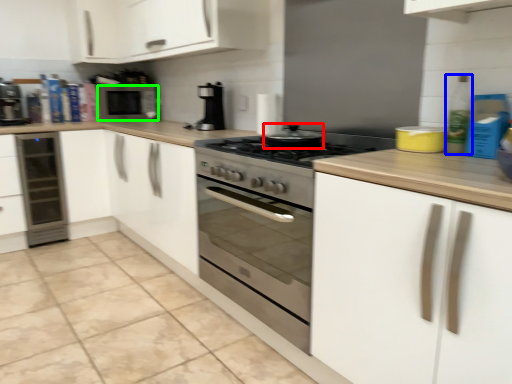
Question: Based on their relative distances, which object is nearer to appliance (highlighted by a red box)? Choose from bottle (highlighted by a blue box) and microwave oven (highlighted by a green box).

Choices:
 (A) bottle
 (B) microwave oven

Answer: (A)